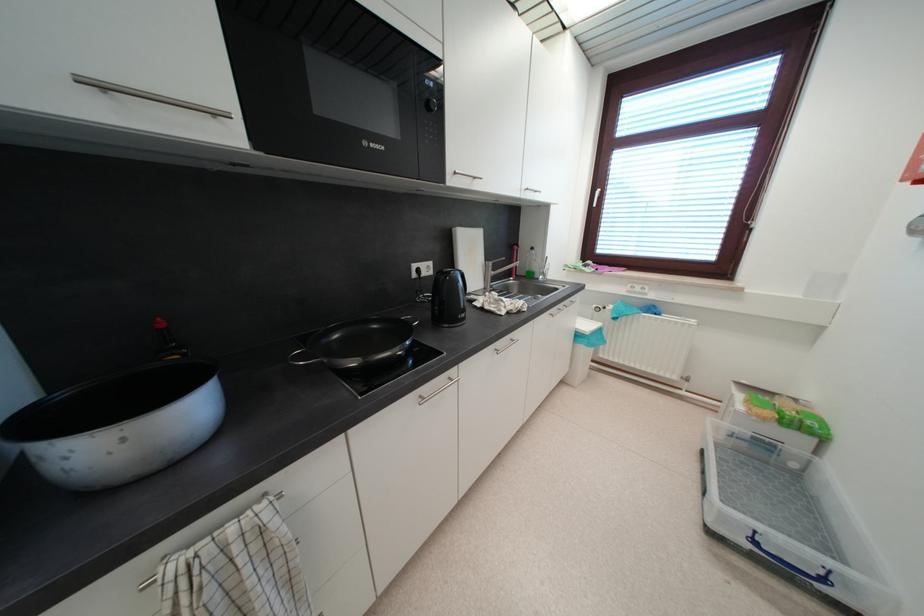
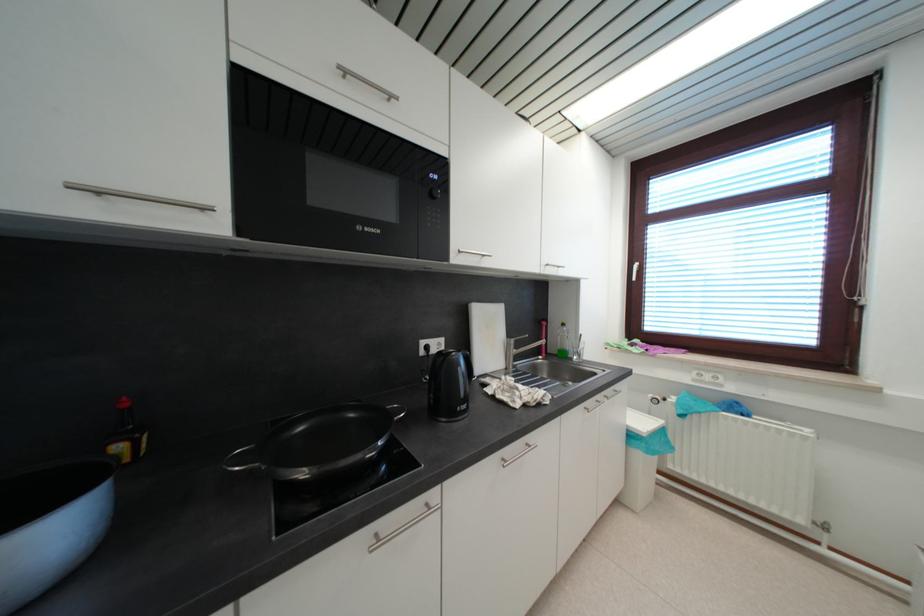
In a continuous first-person perspective shot, in which direction is the camera moving?

The cameraman walked toward right, forward.